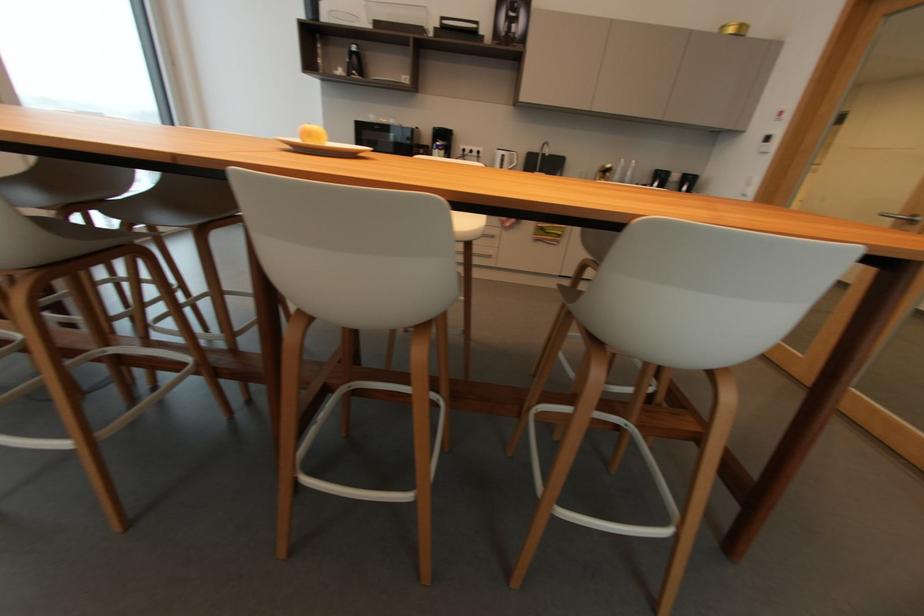
Where is `silver door handle`? The width and height of the screenshot is (924, 616). silver door handle is located at coordinates (901, 217).